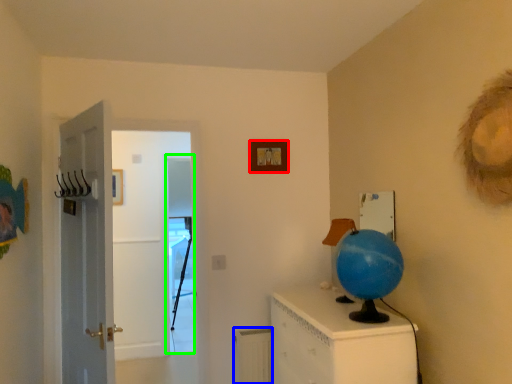
Question: Which object is positioned closest to picture frame (highlighted by a red box)? Select from radiator (highlighted by a blue box) and screen door (highlighted by a green box).

Choices:
 (A) radiator
 (B) screen door

Answer: (A)